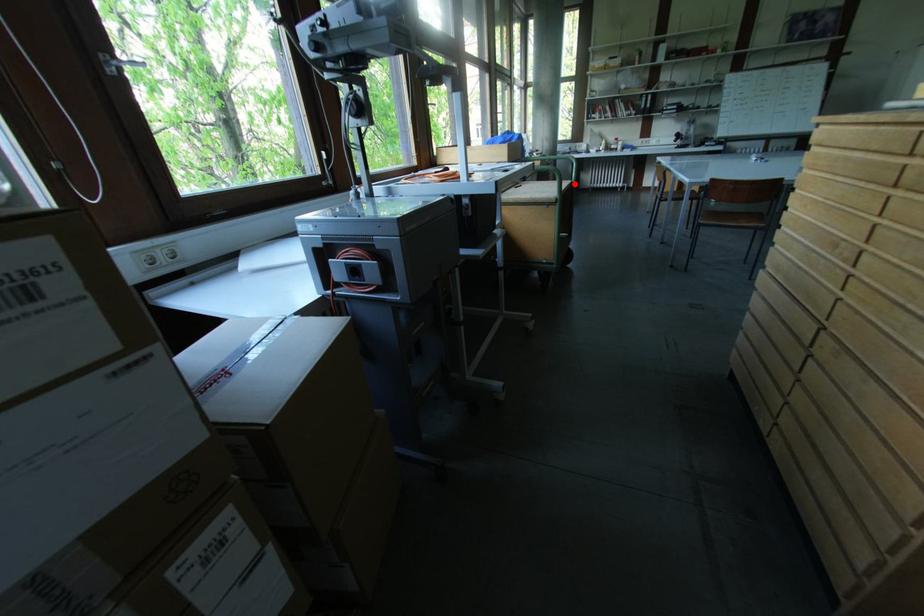
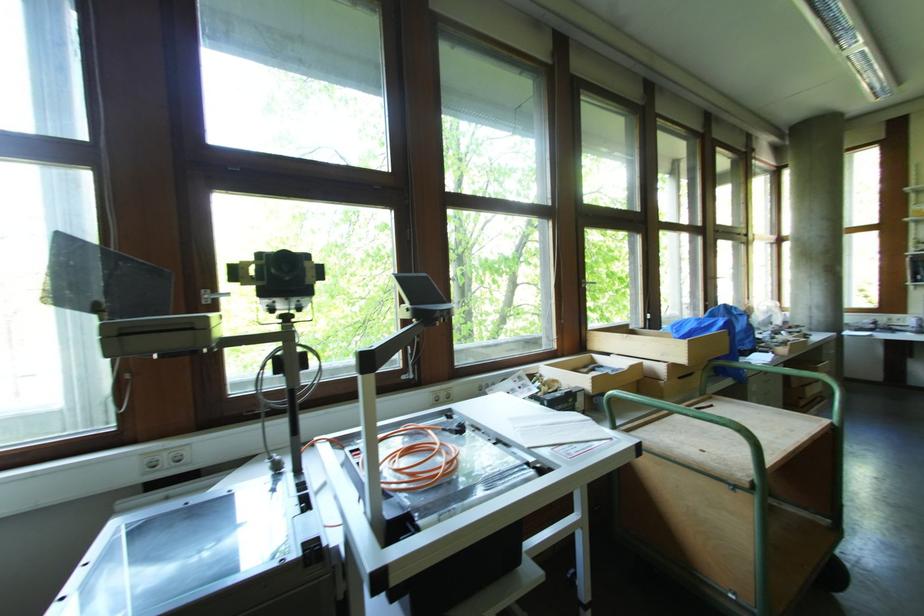
Locate, in the second image, the point that corresponds to the highlighted location in the first image.

(834, 426)